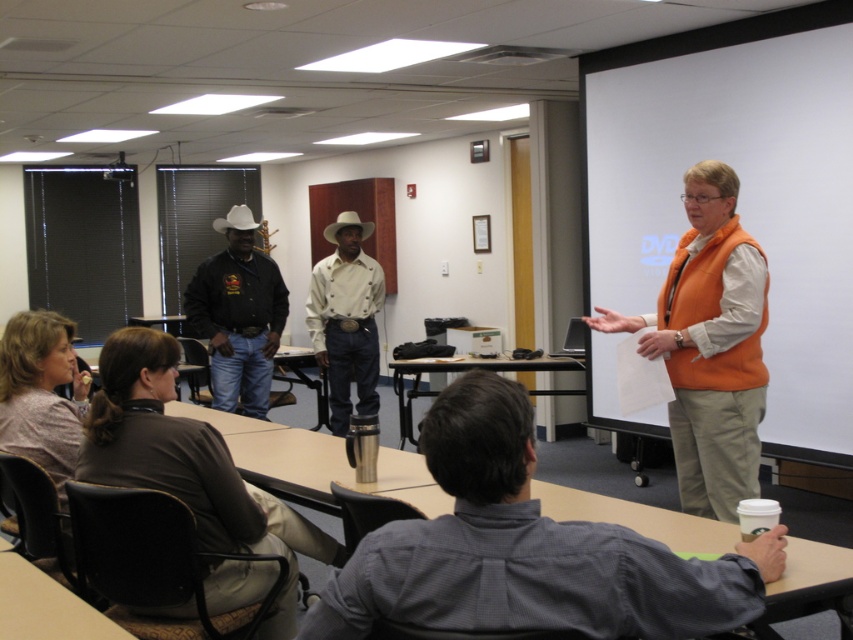
Which is more to the left, dark brown leather jacket at lower left or beige cotton shirt at center?

dark brown leather jacket at lower left

Is dark brown leather jacket at lower left positioned in front of beige cotton shirt at center?

Yes, dark brown leather jacket at lower left is closer to the viewer.

What do you see at coordinates (189, 465) in the screenshot? This screenshot has height=640, width=853. I see `dark brown leather jacket at lower left` at bounding box center [189, 465].

Identify the location of dark brown leather jacket at lower left. The height and width of the screenshot is (640, 853). (189, 465).

The image size is (853, 640). What do you see at coordinates (740, 192) in the screenshot?
I see `white matte projection screen at upper right` at bounding box center [740, 192].

Locate an element on the screen. The height and width of the screenshot is (640, 853). white matte projection screen at upper right is located at coordinates (740, 192).

Between point (646, 44) and point (57, 403), which one is positioned behind?

The point (646, 44) is behind.

Where is `white matte projection screen at upper right`? The image size is (853, 640). white matte projection screen at upper right is located at coordinates (740, 192).

This screenshot has height=640, width=853. What are the coordinates of `white matte projection screen at upper right` in the screenshot? It's located at (740, 192).